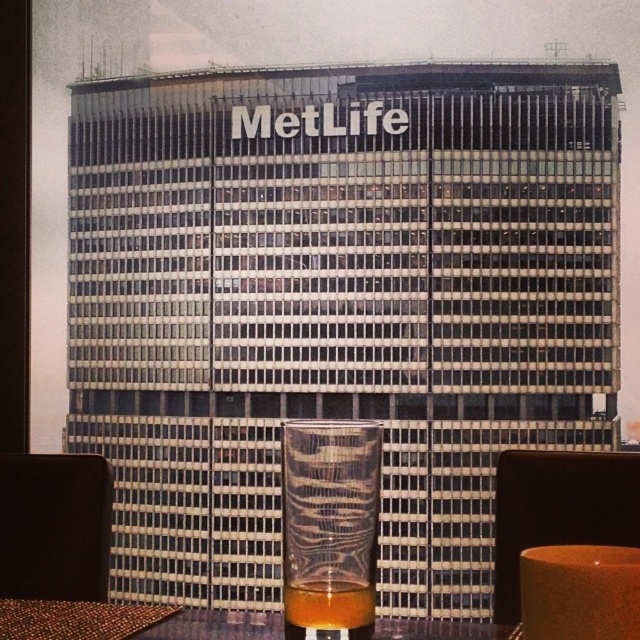
Question: Among these objects, which one is farthest from the camera?

Choices:
 (A) translucent glass at center
 (B) brown woven table at lower left

Answer: (A)

Question: Among these objects, which one is nearest to the camera?

Choices:
 (A) brown woven table at lower left
 (B) translucent glass at center

Answer: (A)

Question: Is translucent glass at center closer to camera compared to brown woven table at lower left?

Choices:
 (A) yes
 (B) no

Answer: (B)

Question: Does translucent glass at center have a greater width compared to brown woven table at lower left?

Choices:
 (A) yes
 (B) no

Answer: (B)

Question: Can you confirm if translucent glass at center is smaller than brown woven table at lower left?

Choices:
 (A) yes
 (B) no

Answer: (A)